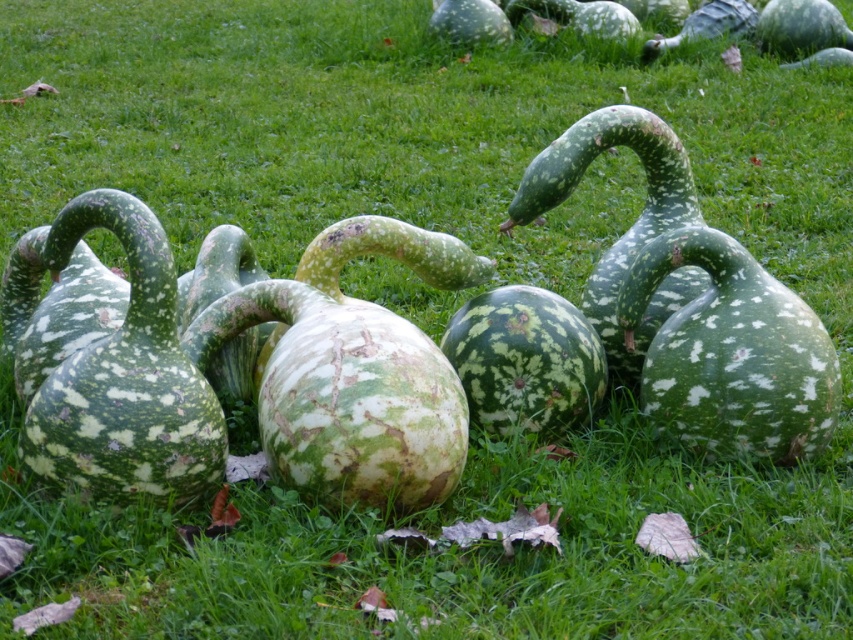
Question: Can you confirm if speckled green gourd at left is thinner than speckled green gourd at center-right?

Choices:
 (A) no
 (B) yes

Answer: (A)

Question: Which point is farther from the camera taking this photo?

Choices:
 (A) (642, 291)
 (B) (547, 429)
 (C) (184, 490)

Answer: (B)

Question: Is speckled green gourd at left closer to camera compared to speckled green gourd at center-right?

Choices:
 (A) no
 (B) yes

Answer: (B)

Question: Is speckled green gourd at left wider than green spotted gourd at center?

Choices:
 (A) yes
 (B) no

Answer: (A)

Question: Considering the real-world distances, which object is closest to the green spotted gourd at center?

Choices:
 (A) speckled green gourd at center-right
 (B) speckled green gourd at left

Answer: (A)

Question: Which of these objects is positioned farthest from the speckled green gourd at left?

Choices:
 (A) green spotted gourd at center
 (B) speckled green gourd at center-right

Answer: (B)